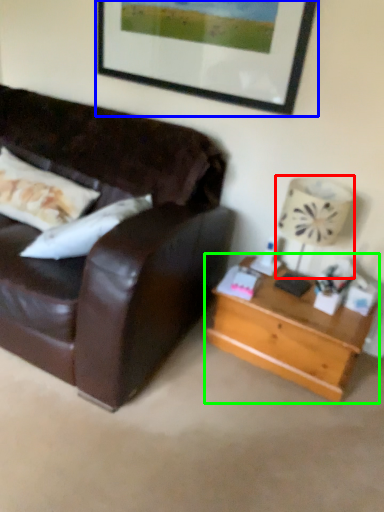
Question: Based on their relative distances, which object is farther from lamp (highlighted by a red box)? Choose from picture frame (highlighted by a blue box) and table (highlighted by a green box).

Choices:
 (A) picture frame
 (B) table

Answer: (A)